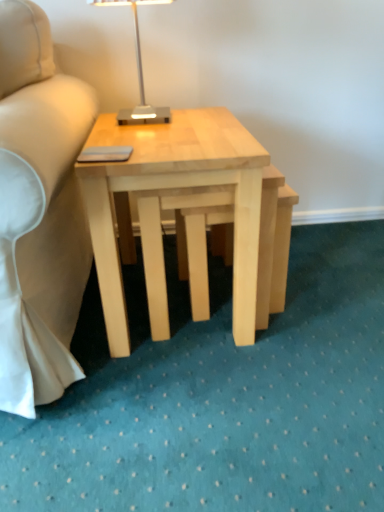
Question: Does natural wood step stool at center have a lesser height compared to metallic silver table lamp at upper center?

Choices:
 (A) no
 (B) yes

Answer: (A)

Question: Are natural wood step stool at center and metallic silver table lamp at upper center located far from each other?

Choices:
 (A) yes
 (B) no

Answer: (B)

Question: Considering the relative positions of natural wood step stool at center and metallic silver table lamp at upper center in the image provided, is natural wood step stool at center to the right of metallic silver table lamp at upper center from the viewer's perspective?

Choices:
 (A) no
 (B) yes

Answer: (B)

Question: Is natural wood step stool at center smaller than metallic silver table lamp at upper center?

Choices:
 (A) yes
 (B) no

Answer: (B)

Question: From a real-world perspective, is natural wood step stool at center beneath metallic silver table lamp at upper center?

Choices:
 (A) no
 (B) yes

Answer: (B)

Question: From a real-world perspective, is natural wood step stool at center physically above metallic silver table lamp at upper center?

Choices:
 (A) yes
 (B) no

Answer: (B)

Question: Are metallic silver table lamp at upper center and natural wood step stool at center making contact?

Choices:
 (A) no
 (B) yes

Answer: (A)

Question: Does metallic silver table lamp at upper center have a lesser width compared to natural wood step stool at center?

Choices:
 (A) yes
 (B) no

Answer: (A)

Question: Considering the relative sizes of metallic silver table lamp at upper center and natural wood step stool at center in the image provided, is metallic silver table lamp at upper center smaller than natural wood step stool at center?

Choices:
 (A) no
 (B) yes

Answer: (B)

Question: Would you say natural wood step stool at center is part of metallic silver table lamp at upper center's contents?

Choices:
 (A) no
 (B) yes

Answer: (A)

Question: Is metallic silver table lamp at upper center positioned far away from natural wood step stool at center?

Choices:
 (A) no
 (B) yes

Answer: (A)

Question: Is metallic silver table lamp at upper center at the right side of natural wood step stool at center?

Choices:
 (A) yes
 (B) no

Answer: (B)

Question: From the image's perspective, is natural wood step stool at center on top of natural wood coffee table at center?

Choices:
 (A) yes
 (B) no

Answer: (B)